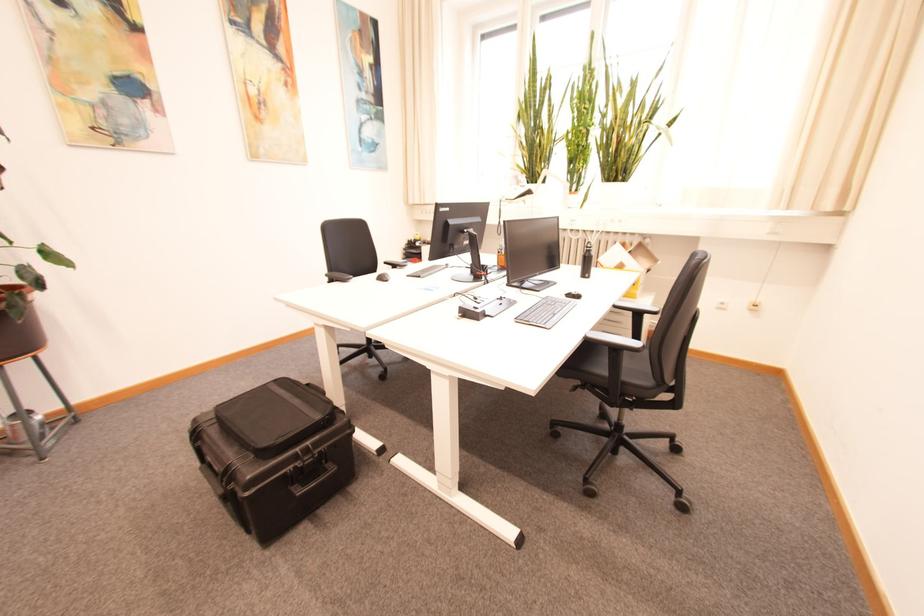
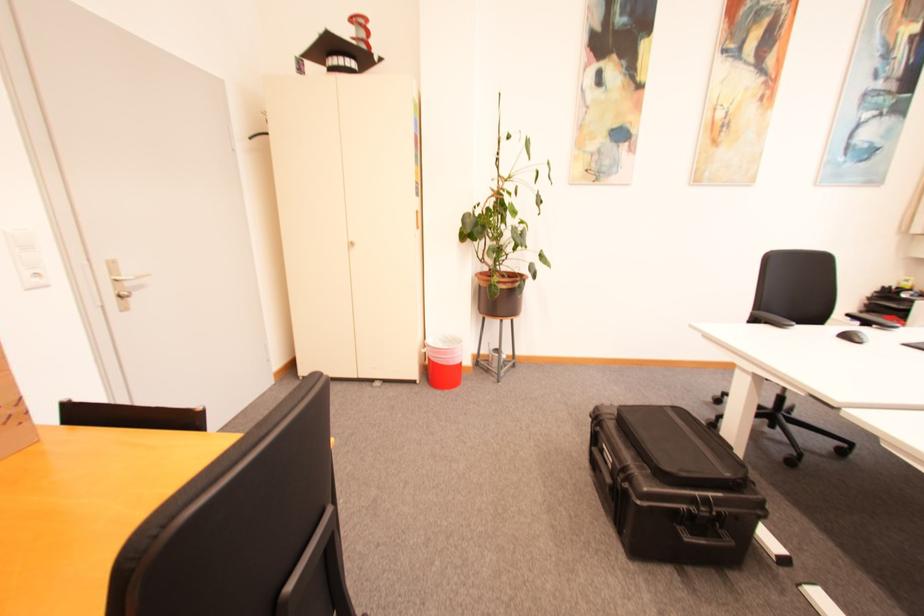
Find the pixel in the second image that matches [392,281] in the first image.

(865, 342)